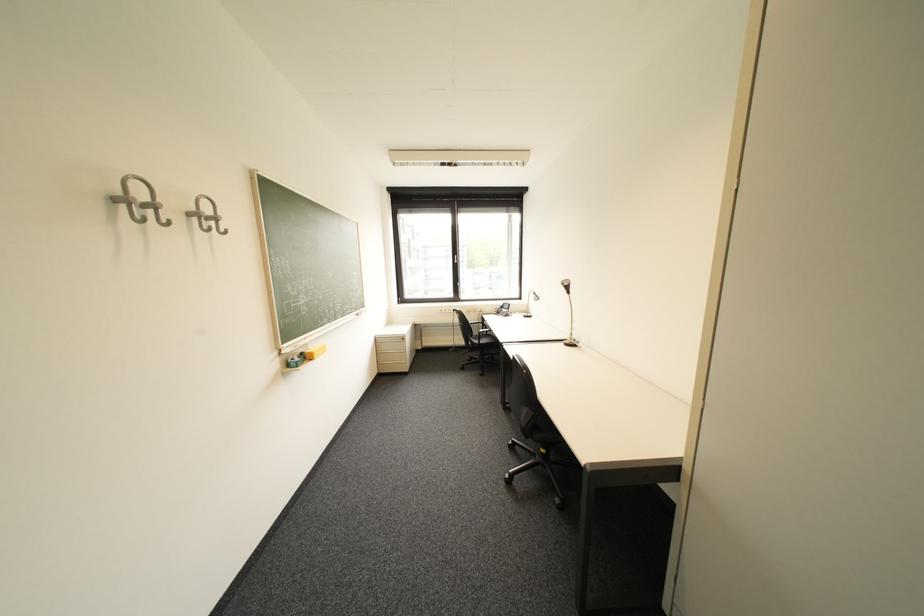
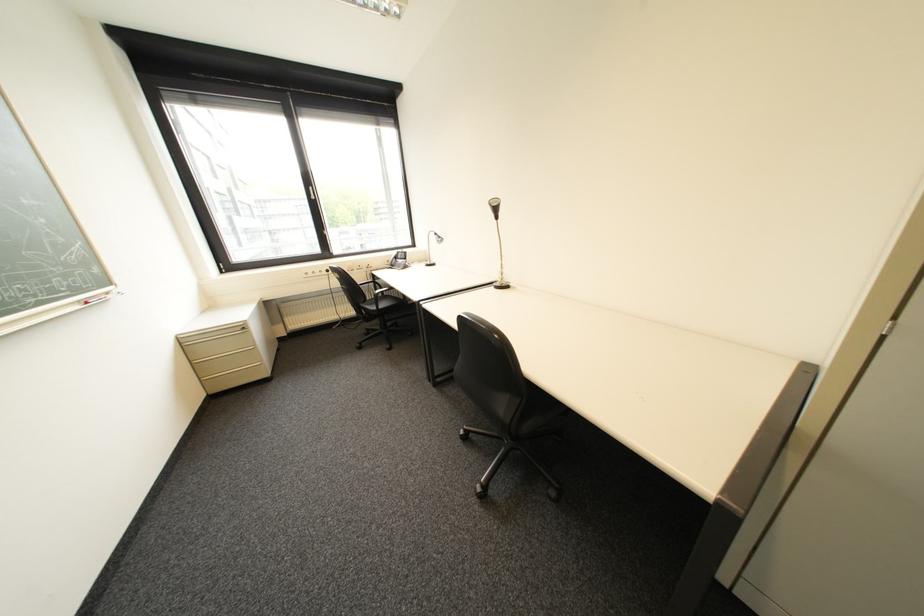
Question: The first image is from the beginning of the video and the second image is from the end. How did the camera likely rotate when shooting the video?

Choices:
 (A) Left
 (B) Right
 (C) Up
 (D) Down

Answer: (B)